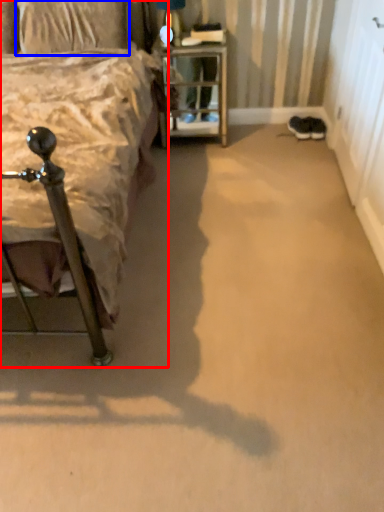
Question: Which point is further to the camera, bed (highlighted by a red box) or pillow (highlighted by a blue box)?

Choices:
 (A) bed
 (B) pillow

Answer: (B)